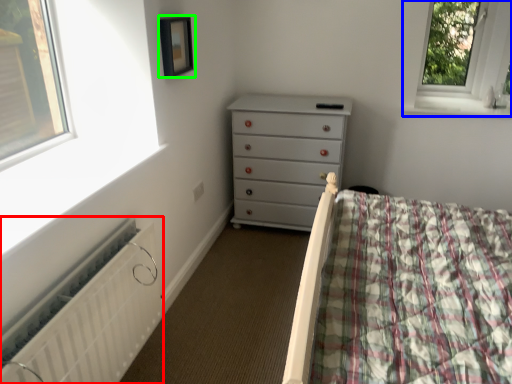
Question: Which is farther away from radiator (highlighted by a red box)? window (highlighted by a blue box) or picture frame (highlighted by a green box)?

Choices:
 (A) window
 (B) picture frame

Answer: (A)